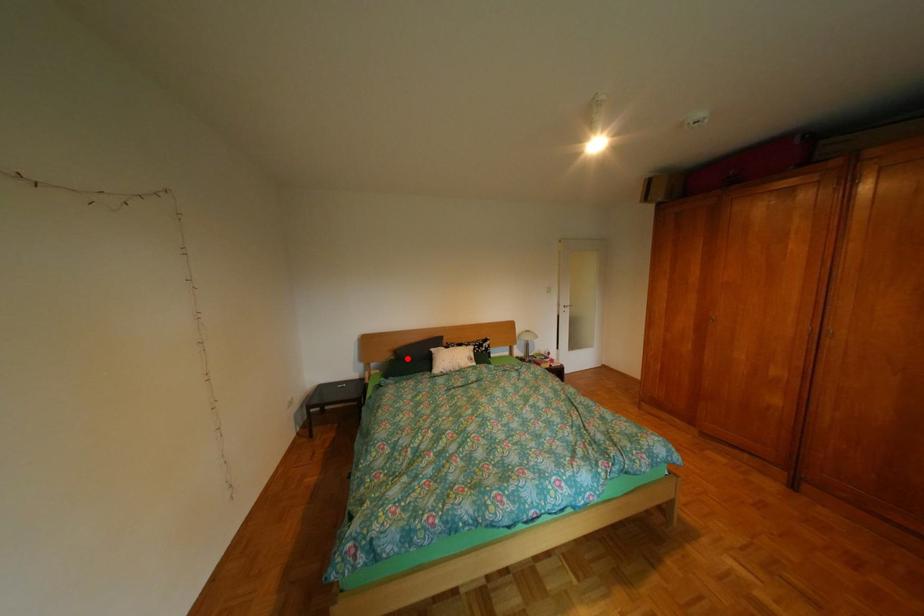
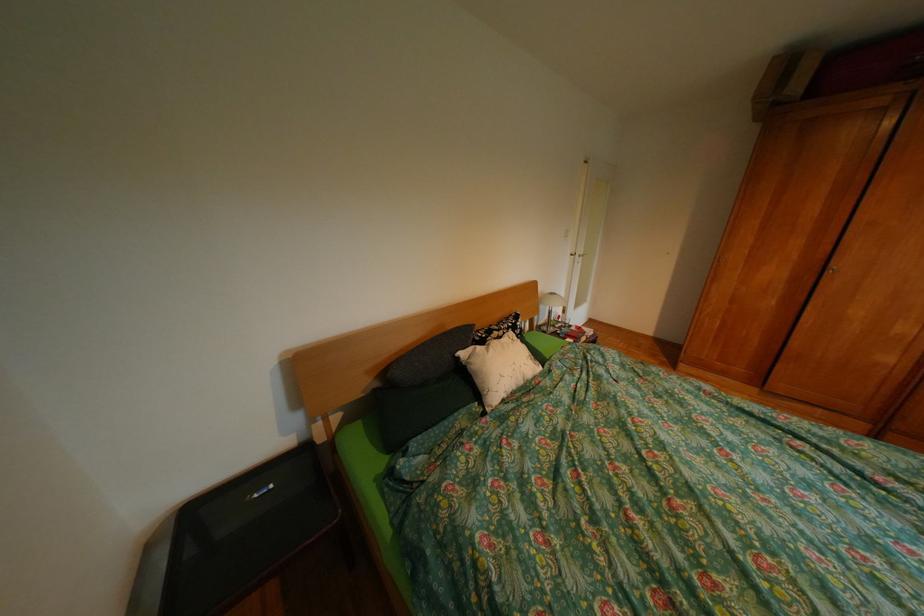
Where in the second image is the point corresponding to the highlighted location from the first image?

(392, 385)